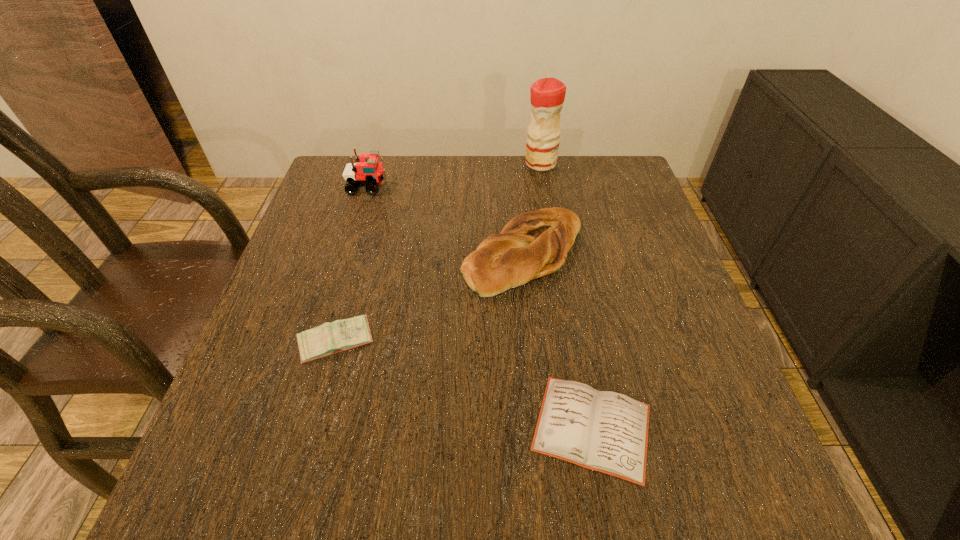
Where is `free region located on the left of the farthest object`? The width and height of the screenshot is (960, 540). free region located on the left of the farthest object is located at coordinates [418, 164].

Where is `free space located 0.110m on the front-facing side of the fourth nearest object`? free space located 0.110m on the front-facing side of the fourth nearest object is located at coordinates (426, 186).

Identify the location of free region located on the right of the third shortest object. The image size is (960, 540). (660, 254).

Locate an element on the screen. This screenshot has height=540, width=960. vacant space situated 0.260m on the back of the fourth farthest object is located at coordinates click(x=365, y=237).

Where is `vacant space located on the left of the nearest object`? vacant space located on the left of the nearest object is located at coordinates (395, 427).

Identify the location of condiment that is at the far edge. (547, 97).

The height and width of the screenshot is (540, 960). Identify the location of Lego positioned at the far edge. (368, 172).

Find the location of a particular element. Image resolution: width=960 pixels, height=540 pixels. object that is positioned at the near edge is located at coordinates (604, 431).

Locate an element on the screen. Lego that is at the left edge is located at coordinates (368, 172).

Find the location of a particular element. The image size is (960, 540). diary that is at the left edge is located at coordinates (330, 338).